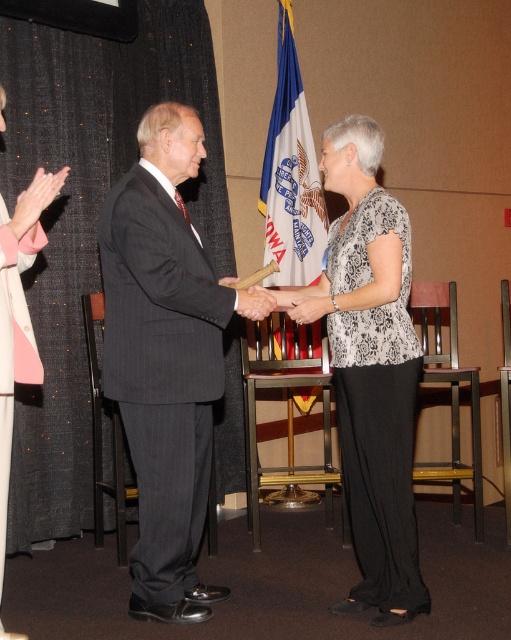
Question: Is white fabric flag at center smaller than white matte hand at center?

Choices:
 (A) no
 (B) yes

Answer: (A)

Question: From the image, what is the correct spatial relationship of dark gray pinstripe suit at center in relation to white fabric flag at center?

Choices:
 (A) left
 (B) right

Answer: (A)

Question: Which point is closer to the camera?

Choices:
 (A) dark gray pinstripe suit at center
 (B) pink fabric at left
 (C) white matte hand at center

Answer: (B)

Question: Among these points, which one is farthest from the camera?

Choices:
 (A) (356, 300)
 (B) (313, 337)
 (C) (289, 300)

Answer: (B)

Question: Observing the image, what is the correct spatial positioning of white matte hand at center in reference to smooth wood hand at center?

Choices:
 (A) right
 (B) left

Answer: (A)

Question: Which object appears farthest from the camera in this image?

Choices:
 (A) white fabric flag at center
 (B) black printed blouse at center
 (C) white matte hand at center
 (D) pink fabric at left

Answer: (A)